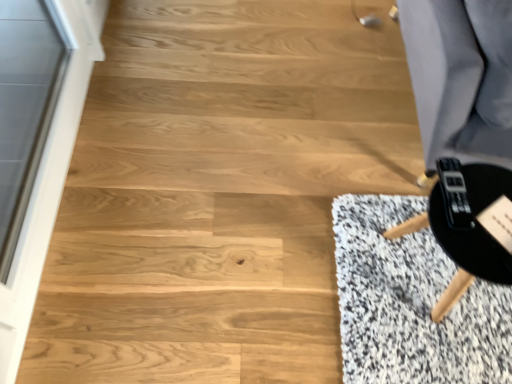
Where is `black matte round table at lower right`? The height and width of the screenshot is (384, 512). black matte round table at lower right is located at coordinates point(471,225).

What do you see at coordinates (26, 159) in the screenshot?
I see `transparent glass screen door at left` at bounding box center [26, 159].

Where is `black matte round table at lower right`? black matte round table at lower right is located at coordinates (471, 225).

Is black matte round table at lower right bigger than transparent glass screen door at left?

No, black matte round table at lower right is not bigger than transparent glass screen door at left.

Is point (441, 179) more distant than point (4, 192)?

No, it is not.

Could you tell me if black matte round table at lower right is facing transparent glass screen door at left?

No, black matte round table at lower right is not turned towards transparent glass screen door at left.

Looking at this image, how different are the orientations of black matte round table at lower right and transparent glass screen door at left in degrees?

90.2 degrees.

Is black matte round table at lower right turned away from black matte game controller at lower right?

No, black matte round table at lower right is not facing the opposite direction of black matte game controller at lower right.

Which is more to the left, black matte round table at lower right or black matte game controller at lower right?

From the viewer's perspective, black matte game controller at lower right appears more on the left side.

Is black matte round table at lower right located outside black matte game controller at lower right?

That's correct, black matte round table at lower right is outside of black matte game controller at lower right.

What's the angular difference between black matte round table at lower right and black matte game controller at lower right's facing directions?

The facing directions of black matte round table at lower right and black matte game controller at lower right are 0.000246 degrees apart.

Image resolution: width=512 pixels, height=384 pixels. I want to click on screen door on the left of black matte game controller at lower right, so click(x=26, y=159).

Could you tell me if black matte game controller at lower right is turned towards transparent glass screen door at left?

No, black matte game controller at lower right is not facing towards transparent glass screen door at left.

From the image's perspective, which object appears higher, black matte game controller at lower right or transparent glass screen door at left?

transparent glass screen door at left.

Considering the positions of objects black matte game controller at lower right and transparent glass screen door at left in the image provided, who is behind, black matte game controller at lower right or transparent glass screen door at left?

black matte game controller at lower right is more distant.

Does black matte game controller at lower right appear on the right side of black matte round table at lower right?

Incorrect, black matte game controller at lower right is not on the right side of black matte round table at lower right.

Is black matte game controller at lower right with black matte round table at lower right?

Yes, black matte game controller at lower right is right next to black matte round table at lower right and making contact.

Can you tell me how much black matte game controller at lower right and black matte round table at lower right differ in facing direction?

0.000246 degrees separate the facing orientations of black matte game controller at lower right and black matte round table at lower right.

Is black matte game controller at lower right spatially inside black matte round table at lower right, or outside of it?

black matte game controller at lower right is spatially positioned inside black matte round table at lower right.

Is transparent glass screen door at left shorter than black matte game controller at lower right?

Incorrect, the height of transparent glass screen door at left does not fall short of that of black matte game controller at lower right.

Is point (15, 320) positioned in front of point (450, 213)?

That is False.

How many degrees apart are the facing directions of transparent glass screen door at left and black matte game controller at lower right?

The angular difference between transparent glass screen door at left and black matte game controller at lower right is 90.2 degrees.

Is transparent glass screen door at left wider than black matte round table at lower right?

No.

What's the angular difference between transparent glass screen door at left and black matte round table at lower right's facing directions?

The angular difference between transparent glass screen door at left and black matte round table at lower right is 90.2 degrees.

Who is more distant, transparent glass screen door at left or black matte round table at lower right?

black matte round table at lower right.

Is point (7, 54) positioned after point (474, 175)?

Yes, point (7, 54) is farther from viewer.

Locate an element on the screen. The image size is (512, 384). screen door above the black matte round table at lower right (from a real-world perspective) is located at coordinates (26, 159).

Where is `round table beneath the black matte game controller at lower right (from a real-world perspective)`? The image size is (512, 384). round table beneath the black matte game controller at lower right (from a real-world perspective) is located at coordinates (471, 225).

Based on their spatial positions, is transparent glass screen door at left or black matte game controller at lower right closer to black matte round table at lower right?

Based on the image, black matte game controller at lower right appears to be nearer to black matte round table at lower right.

In the scene shown: Estimate the real-world distances between objects in this image. Which object is further from black matte game controller at lower right, transparent glass screen door at left or black matte round table at lower right?

transparent glass screen door at left is further to black matte game controller at lower right.

Which object lies nearer to the anchor point transparent glass screen door at left, black matte game controller at lower right or black matte round table at lower right?

Based on the image, black matte round table at lower right appears to be nearer to transparent glass screen door at left.

From the image, which object appears to be nearer to black matte round table at lower right, black matte game controller at lower right or transparent glass screen door at left?

Based on the image, black matte game controller at lower right appears to be nearer to black matte round table at lower right.

Looking at the image, which one is located further to black matte game controller at lower right, black matte round table at lower right or transparent glass screen door at left?

transparent glass screen door at left lies further to black matte game controller at lower right than the other object.

Estimate the real-world distances between objects in this image. Which object is closer to transparent glass screen door at left, black matte round table at lower right or black matte game controller at lower right?

black matte round table at lower right is positioned closer to the anchor transparent glass screen door at left.

Locate an element on the screen. The height and width of the screenshot is (384, 512). game controller situated between transparent glass screen door at left and black matte round table at lower right from left to right is located at coordinates (454, 194).